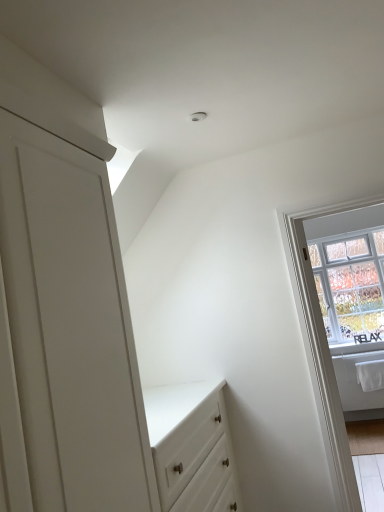
Question: Considering the positions of white plastic window frame at right and clear glass window at upper right in the image, is white plastic window frame at right taller or shorter than clear glass window at upper right?

Choices:
 (A) short
 (B) tall

Answer: (B)

Question: From a real-world perspective, is white plastic window frame at right physically located above or below clear glass window at upper right?

Choices:
 (A) below
 (B) above

Answer: (A)

Question: In terms of width, does white plastic window frame at right look wider or thinner when compared to clear glass window at upper right?

Choices:
 (A) thin
 (B) wide

Answer: (A)

Question: From the image's perspective, is clear glass window at upper right positioned above or below white plastic window frame at right?

Choices:
 (A) above
 (B) below

Answer: (A)

Question: Looking at their shapes, would you say clear glass window at upper right is wider or thinner than white plastic window frame at right?

Choices:
 (A) wide
 (B) thin

Answer: (A)

Question: In the image, is clear glass window at upper right positioned in front of or behind white plastic window frame at right?

Choices:
 (A) front
 (B) behind

Answer: (B)

Question: Choose the correct answer: Is clear glass window at upper right inside white plastic window frame at right or outside it?

Choices:
 (A) outside
 (B) inside

Answer: (A)